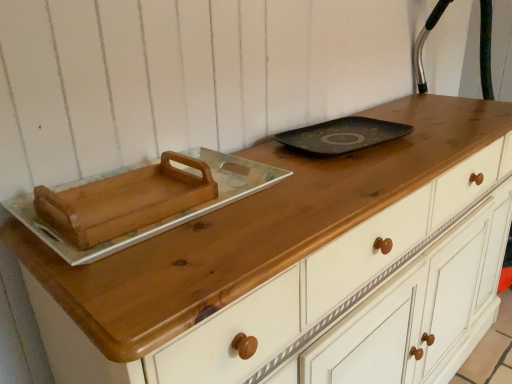
Question: From a real-world perspective, is black matte tray at center physically above wooden tray at left?

Choices:
 (A) no
 (B) yes

Answer: (A)

Question: From a real-world perspective, is black matte tray at center below wooden tray at left?

Choices:
 (A) yes
 (B) no

Answer: (A)

Question: Is black matte tray at center in front of wooden tray at left?

Choices:
 (A) no
 (B) yes

Answer: (A)

Question: Does black matte tray at center have a lesser height compared to wooden tray at left?

Choices:
 (A) yes
 (B) no

Answer: (A)

Question: From the image's perspective, does black matte tray at center appear lower than wooden tray at left?

Choices:
 (A) no
 (B) yes

Answer: (A)

Question: Is wooden tray at left completely or partially inside black matte tray at center?

Choices:
 (A) no
 (B) yes

Answer: (A)

Question: Considering the relative sizes of wooden tray at left and black matte tray at center in the image provided, is wooden tray at left taller than black matte tray at center?

Choices:
 (A) yes
 (B) no

Answer: (A)

Question: Can you confirm if wooden tray at left is positioned to the right of black matte tray at center?

Choices:
 (A) yes
 (B) no

Answer: (B)

Question: From the image's perspective, is wooden tray at left under black matte tray at center?

Choices:
 (A) yes
 (B) no

Answer: (A)

Question: Is wooden tray at left oriented away from black matte tray at center?

Choices:
 (A) no
 (B) yes

Answer: (A)

Question: Are wooden tray at left and black matte tray at center located far from each other?

Choices:
 (A) no
 (B) yes

Answer: (A)

Question: Is wooden tray at left closer to camera compared to black matte tray at center?

Choices:
 (A) no
 (B) yes

Answer: (B)

Question: Is black matte tray at center wider or thinner than wooden tray at left?

Choices:
 (A) thin
 (B) wide

Answer: (B)